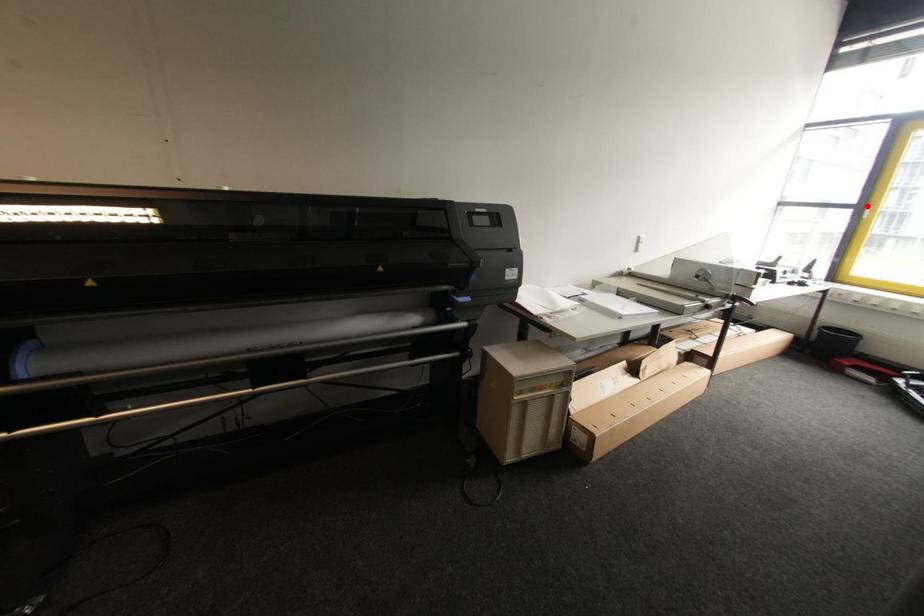
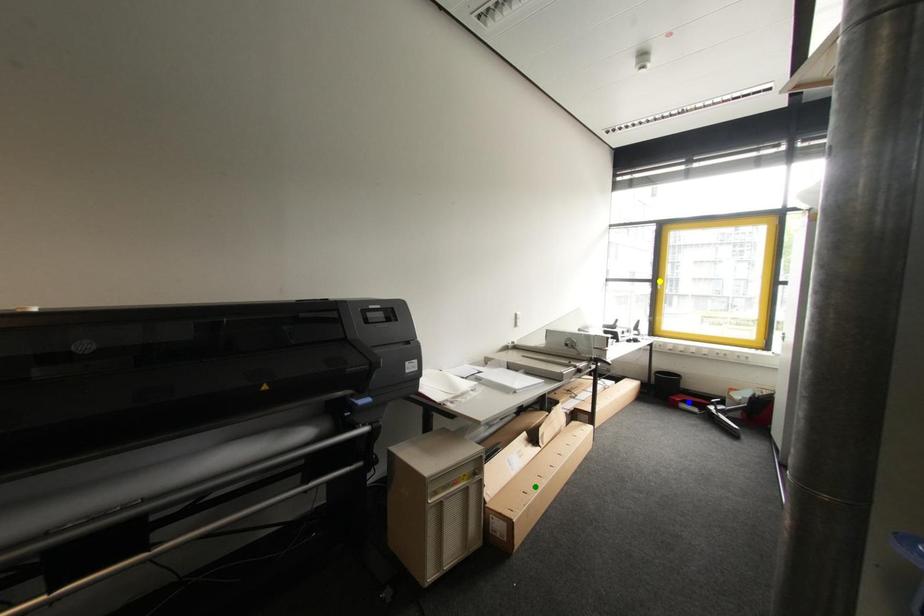
Question: I am providing you with two images of the same scene from different viewpoints. A red point is marked on the first image. You are given multiple points on the second image. Which point in image 2 is actually the same real-world point as the red point in image 1?

Choices:
 (A) yellow point
 (B) blue point
 (C) green point

Answer: (A)